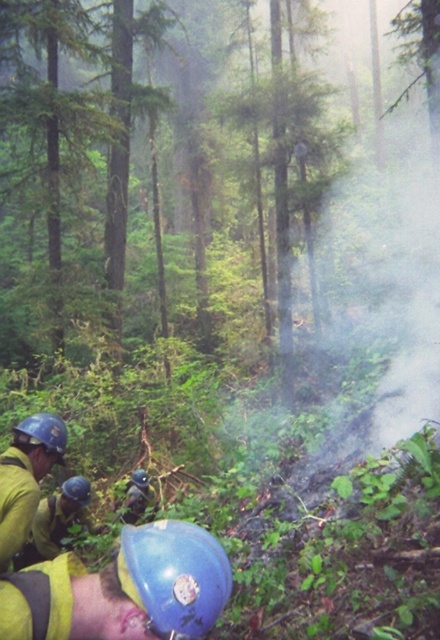
Does yellow fire retardant suit at lower left appear on the left side of matte blue helmet at lower center?

In fact, yellow fire retardant suit at lower left is to the right of matte blue helmet at lower center.

Which is more to the right, yellow fire retardant suit at lower left or matte blue helmet at lower center?

yellow fire retardant suit at lower left

Locate an element on the screen. The image size is (440, 640). yellow fire retardant suit at lower left is located at coordinates (25, 477).

Can you confirm if yellow fire retardant suit at lower left is smaller than matte blue helmet at lower left?

Incorrect, yellow fire retardant suit at lower left is not smaller in size than matte blue helmet at lower left.

How distant is yellow fire retardant suit at lower left from matte blue helmet at lower left?

A distance of 2.14 meters exists between yellow fire retardant suit at lower left and matte blue helmet at lower left.

Between point (15, 474) and point (80, 484), which one is positioned in front?

Point (15, 474) is in front.

Where is `yellow fire retardant suit at lower left`? Image resolution: width=440 pixels, height=640 pixels. yellow fire retardant suit at lower left is located at coordinates (25, 477).

At what (x,y) coordinates should I click in order to perform the action: click on blue matte helmet at lower center. Please return your answer as a coordinate pair (x, y). Looking at the image, I should click on (175, 577).

Is blue matte helmet at lower center positioned at the back of matte blue helmet at lower left?

No, it is in front of matte blue helmet at lower left.

Locate an element on the screen. blue matte helmet at lower center is located at coordinates (175, 577).

Image resolution: width=440 pixels, height=640 pixels. Identify the location of blue matte helmet at lower center. (175, 577).